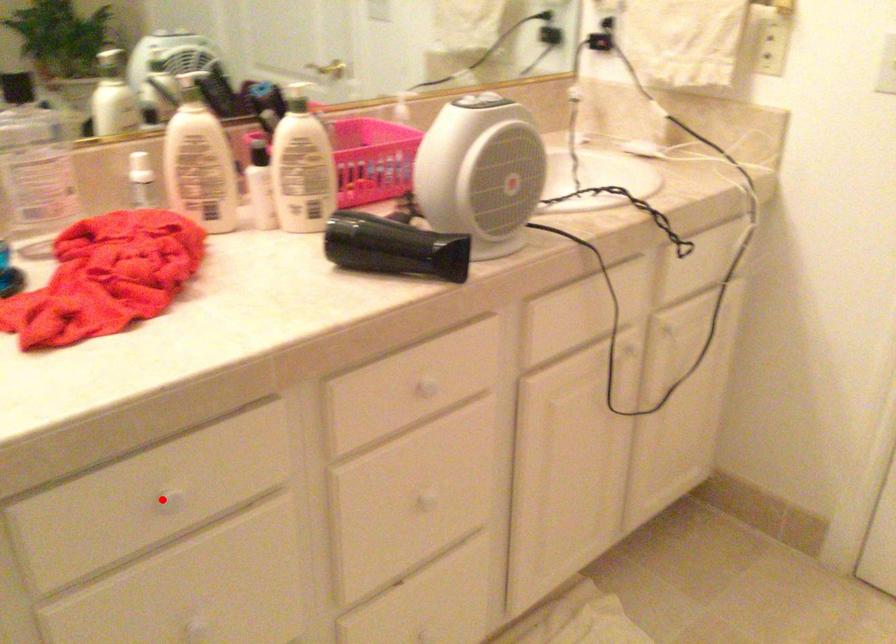
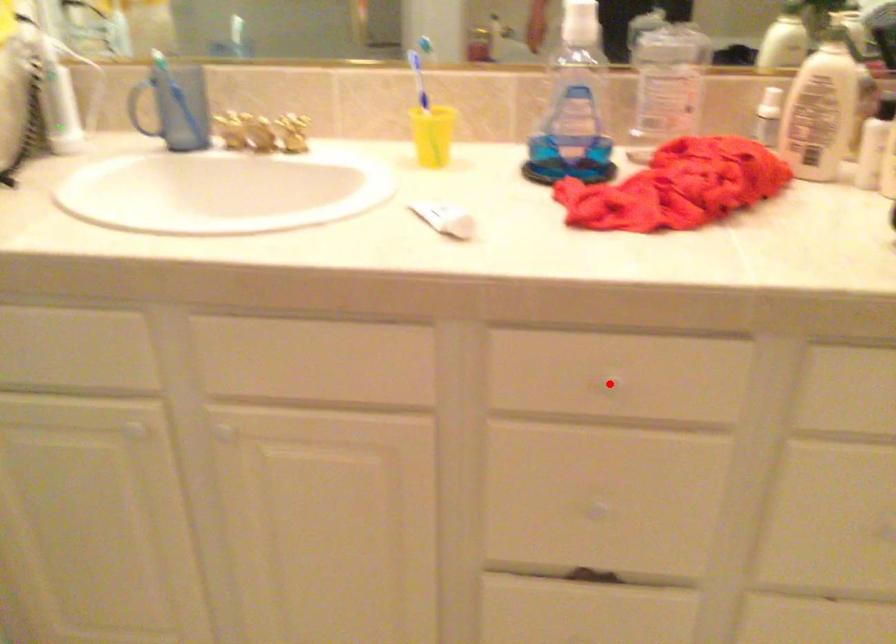
I am providing you with two images of the same scene from different viewpoints. A red point is marked on the first image and another point is marked on the second image. Does the point marked in image1 correspond to the same location as the one in image2?

Yes